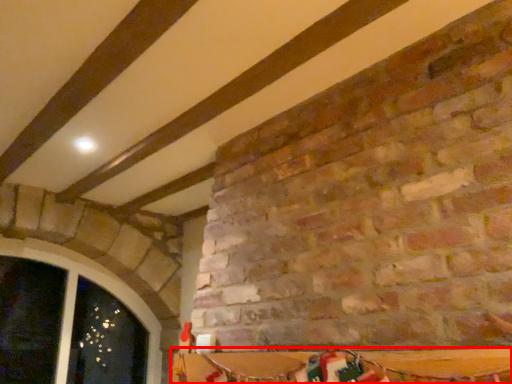
Question: Observing the image, what is the correct spatial positioning of table (annotated by the red box) in reference to window?

Choices:
 (A) right
 (B) left

Answer: (A)